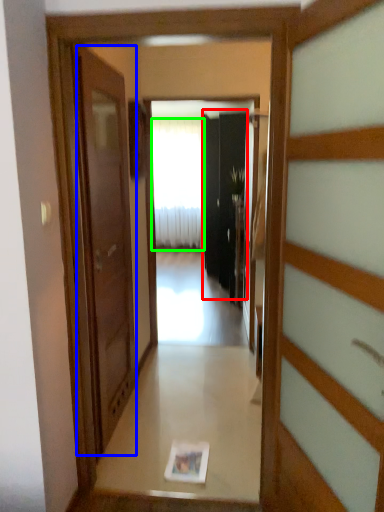
Question: Which is farther away from screen door (highlighted by a red box)? door (highlighted by a blue box) or curtain (highlighted by a green box)?

Choices:
 (A) door
 (B) curtain

Answer: (A)